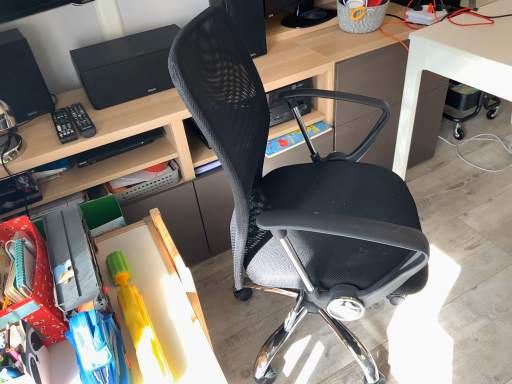
The height and width of the screenshot is (384, 512). Find the location of `free spot below black mesh office chair at center (from a real-world perspective)`. free spot below black mesh office chair at center (from a real-world perspective) is located at coordinates (317, 339).